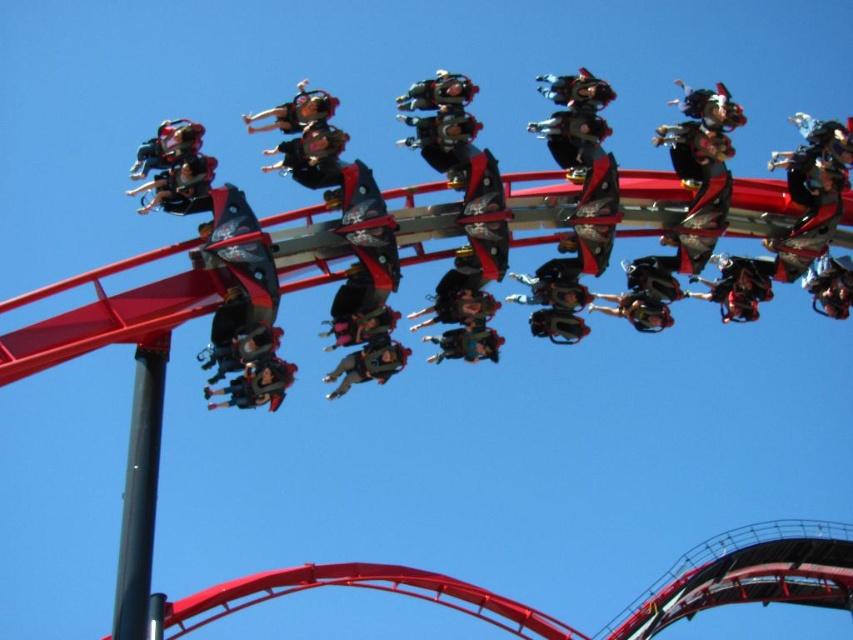
Question: Is matte black helmet at upper left thinner than matte black helmet at upper center?

Choices:
 (A) no
 (B) yes

Answer: (B)

Question: Is matte black seats at center in front of matte black helmet at upper left?

Choices:
 (A) yes
 (B) no

Answer: (A)

Question: Observing the image, what is the correct spatial positioning of matte black seats at center in reference to matte black helmet at upper left?

Choices:
 (A) below
 (B) above

Answer: (A)

Question: Which of the following is the farthest from the observer?

Choices:
 (A) (387, 339)
 (B) (630, 193)

Answer: (B)

Question: Which object is farther from the camera taking this photo?

Choices:
 (A) matte black helmet at upper left
 (B) matte black seats at center

Answer: (A)

Question: Which is farther from the matte black helmet at center?

Choices:
 (A) matte black helmet at upper left
 (B) matte black helmet at upper center

Answer: (A)